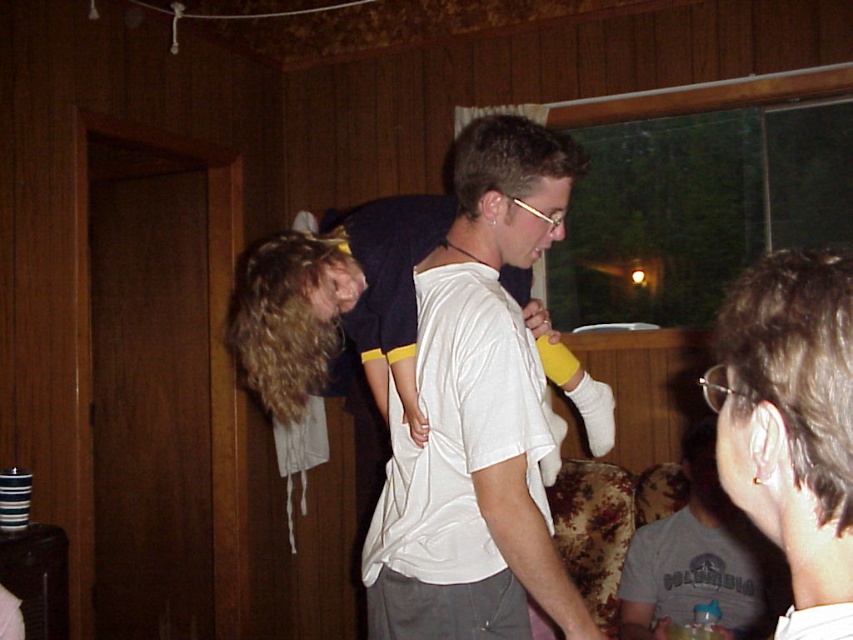
You are at the center of the room and want to move towards the blonde hair at center. What direction should you move in?

Since the blonde hair at center is at point 0.647 on the x axis and 0.560 on the y axis, you should move towards the center of the room where the coordinates are located.